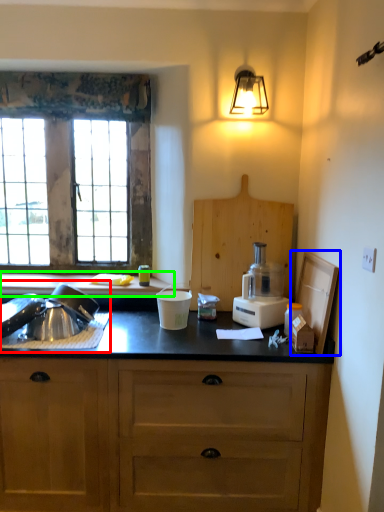
Question: Based on their relative distances, which object is nearer to sink (highlighted by a red box)? Choose from cardboard box (highlighted by a blue box) and countertop (highlighted by a green box).

Choices:
 (A) cardboard box
 (B) countertop

Answer: (B)